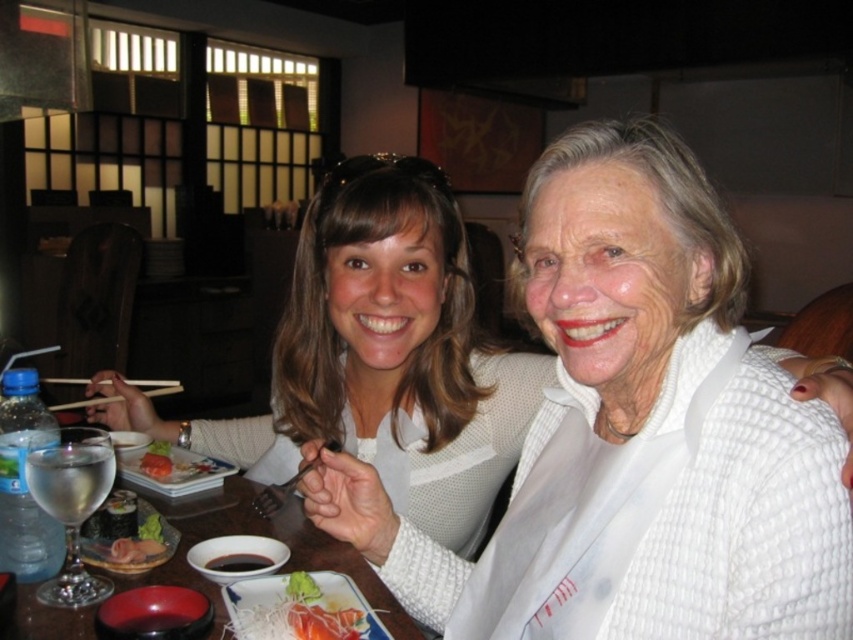
Question: Considering the real-world distances, which object is farthest from the smooth wooden plate at lower left?

Choices:
 (A) wooden chopsticks at left
 (B) slightly translucent pinkish salmon at center
 (C) salmon sashimi at center

Answer: (A)

Question: Can you confirm if wooden chopsticks at left is smaller than black glossy soy sauce at center?

Choices:
 (A) no
 (B) yes

Answer: (A)

Question: Which object is closer to the camera taking this photo?

Choices:
 (A) smooth wooden plate at lower left
 (B) wooden chopsticks at left
 (C) salmon sashimi at center
 (D) slightly translucent pinkish salmon at center

Answer: (D)

Question: Does white textured sweater at center have a lesser width compared to black glossy soy sauce at center?

Choices:
 (A) yes
 (B) no

Answer: (B)

Question: Which object is farther from the camera taking this photo?

Choices:
 (A) slightly translucent pinkish salmon at center
 (B) smooth wooden plate at lower left
 (C) wooden chopsticks at left

Answer: (C)

Question: Is wooden chopsticks at left to the right of black glossy soy sauce at center from the viewer's perspective?

Choices:
 (A) no
 (B) yes

Answer: (A)